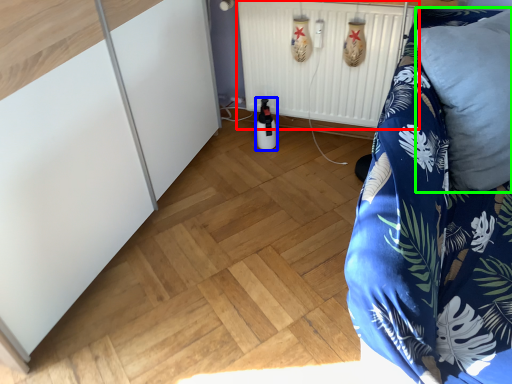
Question: Which is farther away from radiator (highlighted by a red box)? bottle (highlighted by a blue box) or pillow (highlighted by a green box)?

Choices:
 (A) bottle
 (B) pillow

Answer: (B)